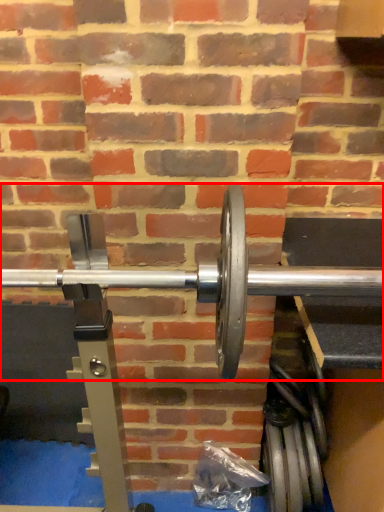
Question: From the image's perspective, where is dumbbell (annotated by the red box) located relative to tire?

Choices:
 (A) above
 (B) below

Answer: (A)